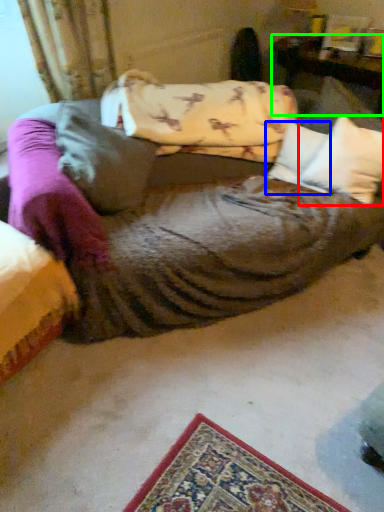
Question: Estimate the real-world distances between objects in this image. Which object is closer to pillow (highlighted by a red box), pillow (highlighted by a blue box) or furniture (highlighted by a green box)?

Choices:
 (A) pillow
 (B) furniture

Answer: (A)